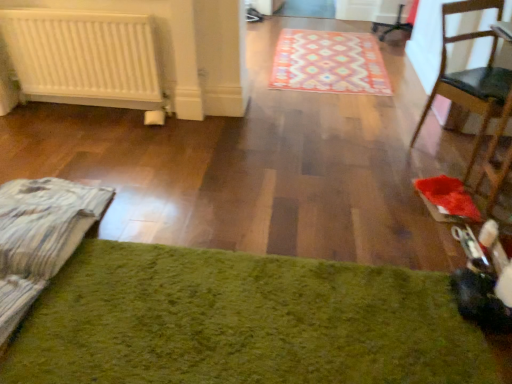
Image resolution: width=512 pixels, height=384 pixels. I want to click on green shaggy rug at lower center, positioned as the 1th mat in front-to-back order, so click(242, 322).

In order to click on wooden chair at right in this screenshot , I will do `click(466, 75)`.

Find the location of a particular element. This screenshot has height=384, width=512. patterned carpet at center, the 1th mat from the top is located at coordinates pos(329,63).

The width and height of the screenshot is (512, 384). What are the coordinates of `green shaggy rug at lower center, positioned as the second mat in top-to-bottom order` in the screenshot? It's located at (242, 322).

What's the angular difference between green shaggy rug at lower center, positioned as the 1th mat in front-to-back order, and white matte radiator at left's facing directions?

179 degrees.

Which object is positioned more to the left, green shaggy rug at lower center, positioned as the second mat in top-to-bottom order, or white matte radiator at left?

white matte radiator at left is more to the left.

Is green shaggy rug at lower center, positioned as the 1th mat in front-to-back order, facing away from white matte radiator at left?

That's not correct — green shaggy rug at lower center, positioned as the 1th mat in front-to-back order, is not looking away from white matte radiator at left.

From the image's perspective, which one is positioned higher, green shaggy rug at lower center, which is the first mat from bottom to top, or white matte radiator at left?

From the image's view, white matte radiator at left is above.

You are a GUI agent. You are given a task and a screenshot of the screen. Output one action in this format:
    pyautogui.click(x=<x>, y=<y>)
    Task: Click on the chair located above the green shaggy rug at lower center, positioned as the second mat in top-to-bottom order (from a real-world perspective)
    The width and height of the screenshot is (512, 384).
    Given the screenshot: What is the action you would take?
    pyautogui.click(x=466, y=75)

Could you tell me if wooden chair at right is turned towards green shaggy rug at lower center, the second mat in the back-to-front sequence?

No, wooden chair at right is not oriented towards green shaggy rug at lower center, the second mat in the back-to-front sequence.

Is there a large distance between wooden chair at right and green shaggy rug at lower center, positioned as the 1th mat in front-to-back order?

Yes, wooden chair at right and green shaggy rug at lower center, positioned as the 1th mat in front-to-back order, are quite far apart.

Is wooden chair at right to the right of green shaggy rug at lower center, positioned as the 1th mat in front-to-back order, from the viewer's perspective?

Indeed, wooden chair at right is positioned on the right side of green shaggy rug at lower center, positioned as the 1th mat in front-to-back order.

From the image's perspective, which object appears higher, patterned carpet at center, positioned as the 1th mat in back-to-front order, or white matte radiator at left?

patterned carpet at center, positioned as the 1th mat in back-to-front order, appears higher in the image.

Find the location of a particular element. The height and width of the screenshot is (384, 512). mat above the white matte radiator at left (from the image's perspective) is located at coordinates (329, 63).

In the image, is patterned carpet at center, the 1th mat from the top, positioned in front of or behind white matte radiator at left?

In the image, patterned carpet at center, the 1th mat from the top, appears behind white matte radiator at left.

Can you confirm if patterned carpet at center, positioned as the 2th mat in bottom-to-top order, is shorter than white matte radiator at left?

Yes, patterned carpet at center, positioned as the 2th mat in bottom-to-top order, is shorter than white matte radiator at left.

Is wooden chair at right positioned with its back to patterned carpet at center, positioned as the 2th mat in bottom-to-top order?

Yes, wooden chair at right is positioned with its back facing patterned carpet at center, positioned as the 2th mat in bottom-to-top order.

From a real-world perspective, between wooden chair at right and patterned carpet at center, the 1th mat from the top, who is vertically lower?

patterned carpet at center, the 1th mat from the top.

Considering the positions of objects wooden chair at right and patterned carpet at center, positioned as the 1th mat in back-to-front order, in the image provided, who is more to the right, wooden chair at right or patterned carpet at center, positioned as the 1th mat in back-to-front order,?

From the viewer's perspective, wooden chair at right appears more on the right side.

Which is in front, point (472, 80) or point (137, 97)?

Positioned in front is point (472, 80).

You are a GUI agent. You are given a task and a screenshot of the screen. Output one action in this format:
    pyautogui.click(x=<x>, y=<y>)
    Task: Click on the chair on the right of white matte radiator at left
    The height and width of the screenshot is (384, 512).
    Given the screenshot: What is the action you would take?
    pyautogui.click(x=466, y=75)

Is wooden chair at right closer to the viewer compared to white matte radiator at left?

Yes.

Does wooden chair at right have a greater width compared to white matte radiator at left?

Indeed, wooden chair at right has a greater width compared to white matte radiator at left.

Is patterned carpet at center, the 1th mat from the top, at the back of green shaggy rug at lower center, which is the first mat from bottom to top?

No, green shaggy rug at lower center, which is the first mat from bottom to top, is not facing the opposite direction of patterned carpet at center, the 1th mat from the top.

Which of these two, green shaggy rug at lower center, which is the first mat from bottom to top, or patterned carpet at center, the 1th mat from the top, is wider?

patterned carpet at center, the 1th mat from the top.

Consider the image. Is green shaggy rug at lower center, which is the first mat from bottom to top, far away from patterned carpet at center, positioned as the 1th mat in back-to-front order?

Yes, green shaggy rug at lower center, which is the first mat from bottom to top, is far from patterned carpet at center, positioned as the 1th mat in back-to-front order.

From the image's perspective, between green shaggy rug at lower center, which is the first mat from bottom to top, and wooden chair at right, which one is located above?

wooden chair at right appears higher in the image.

Is wooden chair at right completely or partially inside green shaggy rug at lower center, positioned as the second mat in top-to-bottom order?

No, wooden chair at right is not surrounded by green shaggy rug at lower center, positioned as the second mat in top-to-bottom order.

Is green shaggy rug at lower center, positioned as the second mat in top-to-bottom order, not close to wooden chair at right?

Yes, green shaggy rug at lower center, positioned as the second mat in top-to-bottom order, and wooden chair at right are located far from each other.

Which object is positioned more to the right, green shaggy rug at lower center, positioned as the 1th mat in front-to-back order, or wooden chair at right?

wooden chair at right.

I want to click on radiator that is above the green shaggy rug at lower center, which is the first mat from bottom to top (from a real-world perspective), so click(83, 57).

You are a GUI agent. You are given a task and a screenshot of the screen. Output one action in this format:
    pyautogui.click(x=<x>, y=<y>)
    Task: Click on the chair lying on the right of green shaggy rug at lower center, positioned as the 1th mat in front-to-back order
    The image size is (512, 384).
    Given the screenshot: What is the action you would take?
    pyautogui.click(x=466, y=75)

Based on their spatial positions, is patterned carpet at center, positioned as the 1th mat in back-to-front order, or white matte radiator at left closer to wooden chair at right?

patterned carpet at center, positioned as the 1th mat in back-to-front order.

From the image, which object appears to be farther from wooden chair at right, white matte radiator at left or green shaggy rug at lower center, positioned as the second mat in top-to-bottom order?

white matte radiator at left lies further to wooden chair at right than the other object.

Which object lies further to the anchor point green shaggy rug at lower center, which is the first mat from bottom to top, patterned carpet at center, positioned as the 2th mat in bottom-to-top order, or wooden chair at right?

Among the two, patterned carpet at center, positioned as the 2th mat in bottom-to-top order, is located further to green shaggy rug at lower center, which is the first mat from bottom to top.

When comparing their distances from white matte radiator at left, does wooden chair at right or patterned carpet at center, positioned as the 1th mat in back-to-front order, seem further?

The object further to white matte radiator at left is wooden chair at right.

When comparing their distances from white matte radiator at left, does green shaggy rug at lower center, positioned as the second mat in top-to-bottom order, or wooden chair at right seem further?

wooden chair at right lies further to white matte radiator at left than the other object.

When comparing their distances from patterned carpet at center, positioned as the 1th mat in back-to-front order, does white matte radiator at left or green shaggy rug at lower center, which is the first mat from bottom to top, seem further?

Based on the image, green shaggy rug at lower center, which is the first mat from bottom to top, appears to be further to patterned carpet at center, positioned as the 1th mat in back-to-front order.

Estimate the real-world distances between objects in this image. Which object is closer to white matte radiator at left, patterned carpet at center, positioned as the 1th mat in back-to-front order, or wooden chair at right?

The object closer to white matte radiator at left is patterned carpet at center, positioned as the 1th mat in back-to-front order.

Looking at the image, which one is located further to wooden chair at right, green shaggy rug at lower center, which is the first mat from bottom to top, or patterned carpet at center, positioned as the 1th mat in back-to-front order?

green shaggy rug at lower center, which is the first mat from bottom to top, lies further to wooden chair at right than the other object.

The image size is (512, 384). Find the location of `chair between green shaggy rug at lower center, which is the first mat from bottom to top, and patterned carpet at center, positioned as the 2th mat in bottom-to-top order, in the front-back direction`. chair between green shaggy rug at lower center, which is the first mat from bottom to top, and patterned carpet at center, positioned as the 2th mat in bottom-to-top order, in the front-back direction is located at coordinates (466, 75).

Locate an element on the screen. The image size is (512, 384). radiator between green shaggy rug at lower center, the second mat in the back-to-front sequence, and patterned carpet at center, positioned as the 1th mat in back-to-front order, along the z-axis is located at coordinates (83, 57).